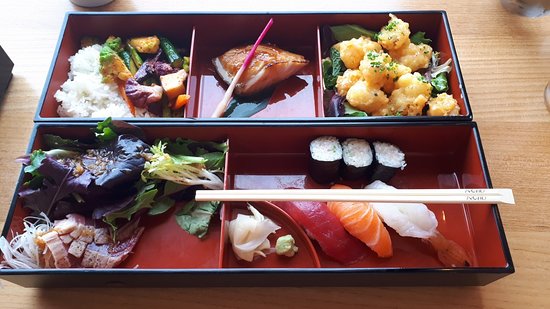
Locate an element on the screen. compartment divider is located at coordinates (221, 239).